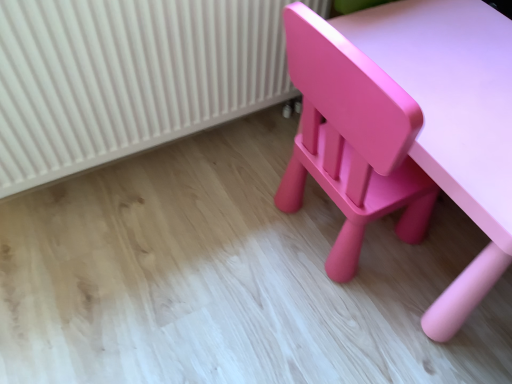
Where is `empty space that is ontop of matte pink table at lower right (from a real-world perspective)`? This screenshot has width=512, height=384. empty space that is ontop of matte pink table at lower right (from a real-world perspective) is located at coordinates (446, 66).